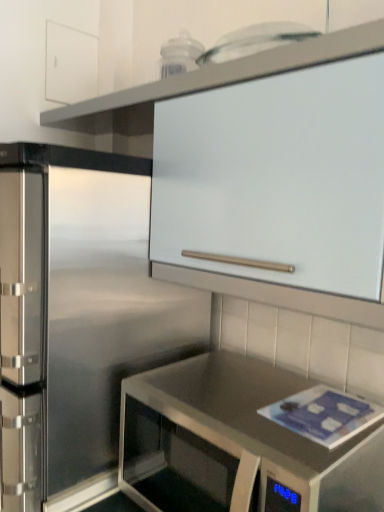
Identify the location of stainless steel countertop at lower right. This screenshot has height=512, width=384. pos(247,440).

What is the approximate width of white matte cabinet at upper center, acting as the 2th cabinetry starting from the back?

white matte cabinet at upper center, acting as the 2th cabinetry starting from the back, is 14.40 inches wide.

Where is `stainless steel countertop at lower right`? stainless steel countertop at lower right is located at coordinates (247, 440).

From a real-world perspective, is white matte cabinet at upper left, arranged as the second cabinetry when viewed from the front, physically located above or below white matte cabinet at upper center, which ranks as the 2th cabinetry in left-to-right order?

Clearly, from a real-world perspective, white matte cabinet at upper left, arranged as the second cabinetry when viewed from the front, is above white matte cabinet at upper center, which ranks as the 2th cabinetry in left-to-right order.

Is white matte cabinet at upper left, which appears as the first cabinetry when viewed from the left, not within white matte cabinet at upper center, placed as the 1th cabinetry when sorted from bottom to top?

Yes, white matte cabinet at upper left, which appears as the first cabinetry when viewed from the left, is outside of white matte cabinet at upper center, placed as the 1th cabinetry when sorted from bottom to top.

Locate an element on the screen. This screenshot has width=384, height=512. cabinetry in front of the white matte cabinet at upper left, arranged as the second cabinetry when viewed from the front is located at coordinates (200, 88).

How different are the orientations of white matte cabinet at upper left, arranged as the second cabinetry when viewed from the front, and white matte cabinet at upper center, the 2th cabinetry in the top-to-bottom sequence, in degrees?

90.4 degrees.

Which object is wider, white matte cabinet at upper center, the 2th cabinetry in the top-to-bottom sequence, or white matte cabinet at upper left, the 1th cabinetry in the back-to-front sequence?

Wider between the two is white matte cabinet at upper center, the 2th cabinetry in the top-to-bottom sequence.

Is white matte cabinet at upper center, acting as the 1th cabinetry starting from the right, spatially inside white matte cabinet at upper left, marked as the second cabinetry in a bottom-to-top arrangement, or outside of it?

white matte cabinet at upper center, acting as the 1th cabinetry starting from the right, exists outside the volume of white matte cabinet at upper left, marked as the second cabinetry in a bottom-to-top arrangement.

Which is more distant, (x=316, y=305) or (x=80, y=95)?

The point (x=80, y=95) is behind.

From the picture: Is white matte cabinet at upper center, the first cabinetry in the front-to-back sequence, closer to camera compared to white matte cabinet at upper left, arranged as the 1th cabinetry when viewed from the top?

Yes, white matte cabinet at upper center, the first cabinetry in the front-to-back sequence, is in front of white matte cabinet at upper left, arranged as the 1th cabinetry when viewed from the top.

Which point is more distant from viewer, (354, 448) or (383, 304)?

The point (354, 448) is farther from the camera.

Could you tell me if stainless steel countertop at lower right is facing white matte cabinet at upper center, acting as the 2th cabinetry starting from the back?

No, stainless steel countertop at lower right is not facing towards white matte cabinet at upper center, acting as the 2th cabinetry starting from the back.

Can you see stainless steel countertop at lower right touching white matte cabinet at upper center, the first cabinetry in the front-to-back sequence?

There is a gap between stainless steel countertop at lower right and white matte cabinet at upper center, the first cabinetry in the front-to-back sequence.

Where is `countertop located below the white matte cabinet at upper center, placed as the 1th cabinetry when sorted from bottom to top (from the image's perspective)`? countertop located below the white matte cabinet at upper center, placed as the 1th cabinetry when sorted from bottom to top (from the image's perspective) is located at coordinates (247, 440).

Is white matte cabinet at upper center, the 2th cabinetry in the top-to-bottom sequence, at the right side of stainless steel countertop at lower right?

In fact, white matte cabinet at upper center, the 2th cabinetry in the top-to-bottom sequence, is to the left of stainless steel countertop at lower right.

Would you consider white matte cabinet at upper center, acting as the 1th cabinetry starting from the right, to be distant from stainless steel countertop at lower right?

No, white matte cabinet at upper center, acting as the 1th cabinetry starting from the right, is not far from stainless steel countertop at lower right.

Considering the relative sizes of white matte cabinet at upper center, the 2th cabinetry in the top-to-bottom sequence, and stainless steel countertop at lower right in the image provided, is white matte cabinet at upper center, the 2th cabinetry in the top-to-bottom sequence, thinner than stainless steel countertop at lower right?

Correct, the width of white matte cabinet at upper center, the 2th cabinetry in the top-to-bottom sequence, is less than that of stainless steel countertop at lower right.

I want to click on the 1st cabinetry located above the stainless steel countertop at lower right (from a real-world perspective), so click(x=200, y=88).

Considering the positions of objects stainless steel countertop at lower right and white matte cabinet at upper left, arranged as the 1th cabinetry when viewed from the top, in the image provided, who is more to the right, stainless steel countertop at lower right or white matte cabinet at upper left, arranged as the 1th cabinetry when viewed from the top,?

stainless steel countertop at lower right is more to the right.

Considering the sizes of objects stainless steel countertop at lower right and white matte cabinet at upper left, the 1th cabinetry in the back-to-front sequence, in the image provided, who is taller, stainless steel countertop at lower right or white matte cabinet at upper left, the 1th cabinetry in the back-to-front sequence,?

stainless steel countertop at lower right is taller.

Where is `countertop located on the right of white matte cabinet at upper left, positioned as the 2th cabinetry in right-to-left order`? countertop located on the right of white matte cabinet at upper left, positioned as the 2th cabinetry in right-to-left order is located at coordinates (247, 440).

Is white matte cabinet at upper left, marked as the second cabinetry in a bottom-to-top arrangement, next to stainless steel countertop at lower right and touching it?

No.

What's the angular difference between white matte cabinet at upper left, the 1th cabinetry in the back-to-front sequence, and stainless steel countertop at lower right's facing directions?

They differ by 90.3 degrees in their facing directions.

Is white matte cabinet at upper left, arranged as the 1th cabinetry when viewed from the top, completely or partially outside of stainless steel countertop at lower right?

Absolutely, white matte cabinet at upper left, arranged as the 1th cabinetry when viewed from the top, is external to stainless steel countertop at lower right.

Is white matte cabinet at upper left, arranged as the 1th cabinetry when viewed from the top, wider or thinner than stainless steel countertop at lower right?

Clearly, white matte cabinet at upper left, arranged as the 1th cabinetry when viewed from the top, has less width compared to stainless steel countertop at lower right.

This screenshot has height=512, width=384. What are the coordinates of `cabinetry below the white matte cabinet at upper left, positioned as the 2th cabinetry in right-to-left order (from the image's perspective)` in the screenshot? It's located at (200, 88).

Locate an element on the screen. This screenshot has height=512, width=384. cabinetry on the right side of white matte cabinet at upper left, positioned as the 2th cabinetry in right-to-left order is located at coordinates (200, 88).

From the image, which object appears to be farther from white matte cabinet at upper left, arranged as the 1th cabinetry when viewed from the top, stainless steel countertop at lower right or white matte cabinet at upper center, which ranks as the 2th cabinetry in left-to-right order?

stainless steel countertop at lower right lies further to white matte cabinet at upper left, arranged as the 1th cabinetry when viewed from the top, than the other object.

From the image, which object appears to be nearer to stainless steel countertop at lower right, white matte cabinet at upper left, arranged as the second cabinetry when viewed from the front, or white matte cabinet at upper center, acting as the 2th cabinetry starting from the back?

Among the two, white matte cabinet at upper center, acting as the 2th cabinetry starting from the back, is located nearer to stainless steel countertop at lower right.

Considering their positions, is white matte cabinet at upper center, the 2th cabinetry in the top-to-bottom sequence, positioned further to stainless steel countertop at lower right than white matte cabinet at upper left, marked as the second cabinetry in a bottom-to-top arrangement?

white matte cabinet at upper left, marked as the second cabinetry in a bottom-to-top arrangement, lies further to stainless steel countertop at lower right than the other object.

From the image, which object appears to be farther from white matte cabinet at upper center, placed as the 1th cabinetry when sorted from bottom to top, stainless steel countertop at lower right or white matte cabinet at upper left, arranged as the second cabinetry when viewed from the front?

stainless steel countertop at lower right is positioned further to the anchor white matte cabinet at upper center, placed as the 1th cabinetry when sorted from bottom to top.

Considering their positions, is white matte cabinet at upper left, which appears as the first cabinetry when viewed from the left, positioned further to white matte cabinet at upper center, placed as the 1th cabinetry when sorted from bottom to top, than stainless steel countertop at lower right?

The object further to white matte cabinet at upper center, placed as the 1th cabinetry when sorted from bottom to top, is stainless steel countertop at lower right.

When comparing their distances from white matte cabinet at upper left, which appears as the first cabinetry when viewed from the left, does white matte cabinet at upper center, which ranks as the 2th cabinetry in left-to-right order, or stainless steel countertop at lower right seem closer?

white matte cabinet at upper center, which ranks as the 2th cabinetry in left-to-right order, lies closer to white matte cabinet at upper left, which appears as the first cabinetry when viewed from the left, than the other object.

You are a GUI agent. You are given a task and a screenshot of the screen. Output one action in this format:
    pyautogui.click(x=<x>, y=<y>)
    Task: Click on the cabinetry between white matte cabinet at upper left, the 1th cabinetry in the back-to-front sequence, and stainless steel countertop at lower right, in the vertical direction
    
    Given the screenshot: What is the action you would take?
    pyautogui.click(x=200, y=88)